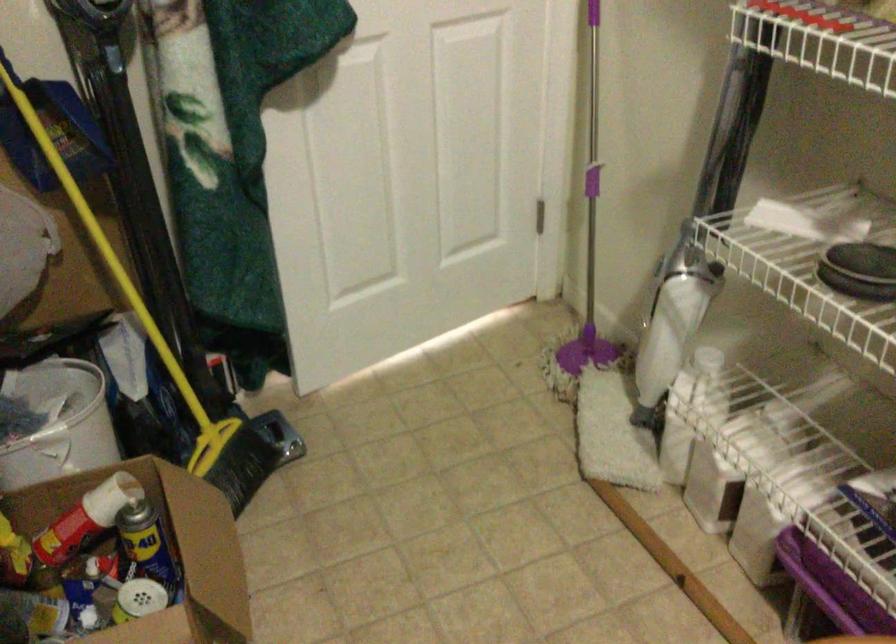
This screenshot has width=896, height=644. Describe the element at coordinates (593, 55) in the screenshot. I see `the metal mop handle` at that location.